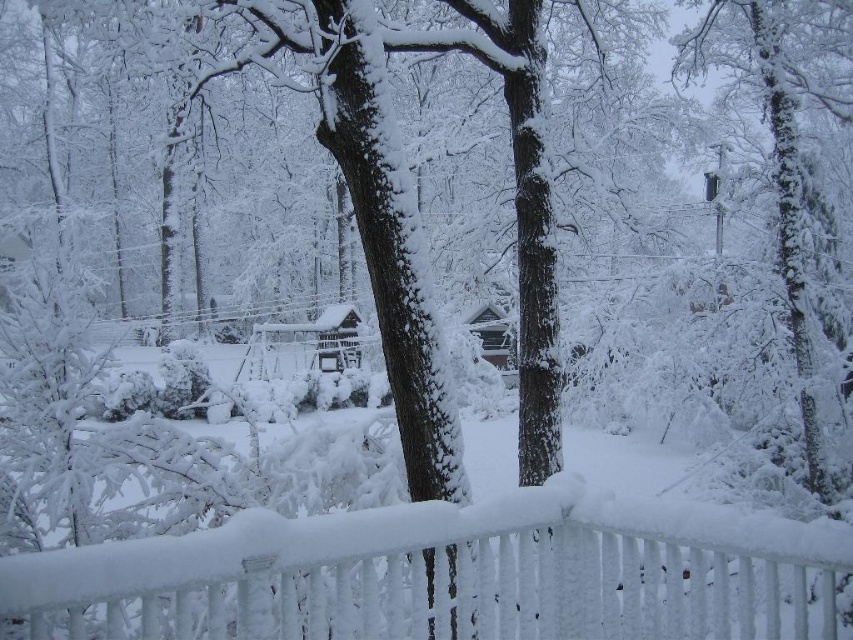
Between white frosted fence at lower center and snow-covered tree at upper right, which one is positioned lower?

snow-covered tree at upper right is lower down.

Is white frosted fence at lower center bigger than snow-covered tree at upper right?

Yes.

Is point (480, 625) closer to camera compared to point (808, 436)?

Yes, point (480, 625) is closer to viewer.

Find the location of `white frosted fence at lower center`. white frosted fence at lower center is located at coordinates (451, 576).